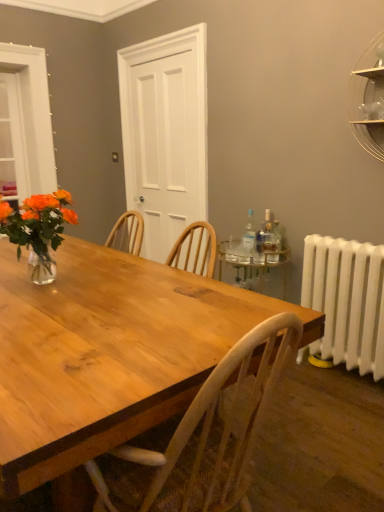
Question: Is white matte door at center completely or partially inside clear glass shelf at upper right?

Choices:
 (A) yes
 (B) no

Answer: (B)

Question: Could you tell me if clear glass shelf at upper right is turned towards white matte door at center?

Choices:
 (A) yes
 (B) no

Answer: (B)

Question: Does clear glass shelf at upper right appear on the right side of white matte door at center?

Choices:
 (A) yes
 (B) no

Answer: (A)

Question: Would you say clear glass shelf at upper right is outside white matte door at center?

Choices:
 (A) no
 (B) yes

Answer: (B)

Question: Does clear glass shelf at upper right appear on the left side of white matte door at center?

Choices:
 (A) no
 (B) yes

Answer: (A)

Question: Is clear glass shelf at upper right closer to the viewer compared to white matte door at center?

Choices:
 (A) no
 (B) yes

Answer: (B)

Question: Is clear glass bottle at right, which ranks as the 3th bottle in left-to-right order, completely or partially outside of translucent glass vase at left?

Choices:
 (A) yes
 (B) no

Answer: (A)

Question: Can you confirm if clear glass bottle at right, which ranks as the 3th bottle in left-to-right order, is bigger than translucent glass vase at left?

Choices:
 (A) no
 (B) yes

Answer: (A)

Question: From a real-world perspective, is clear glass bottle at right, the 1th bottle positioned from the right, over translucent glass vase at left?

Choices:
 (A) no
 (B) yes

Answer: (A)

Question: Is clear glass bottle at right, which ranks as the 3th bottle in left-to-right order, wider than translucent glass vase at left?

Choices:
 (A) yes
 (B) no

Answer: (B)

Question: Considering the relative sizes of clear glass bottle at right, which ranks as the 3th bottle in left-to-right order, and translucent glass vase at left in the image provided, is clear glass bottle at right, which ranks as the 3th bottle in left-to-right order, taller than translucent glass vase at left?

Choices:
 (A) yes
 (B) no

Answer: (B)

Question: Does clear glass bottle at right, the 1th bottle positioned from the right, have a smaller size compared to translucent glass vase at left?

Choices:
 (A) yes
 (B) no

Answer: (A)

Question: Is the depth of transparent plastic bottle at right, which is the first bottle in left-to-right order, less than that of white matte door at center?

Choices:
 (A) yes
 (B) no

Answer: (A)